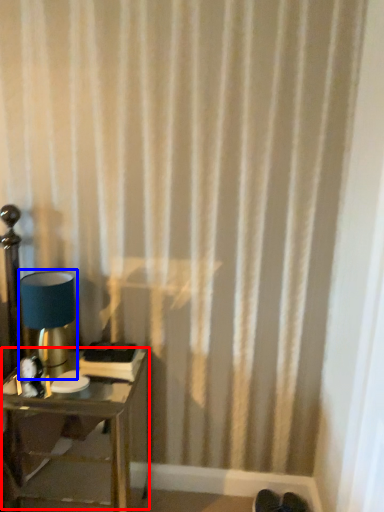
Question: Which object is further to the camera taking this photo, table (highlighted by a red box) or lamp (highlighted by a blue box)?

Choices:
 (A) table
 (B) lamp

Answer: (B)